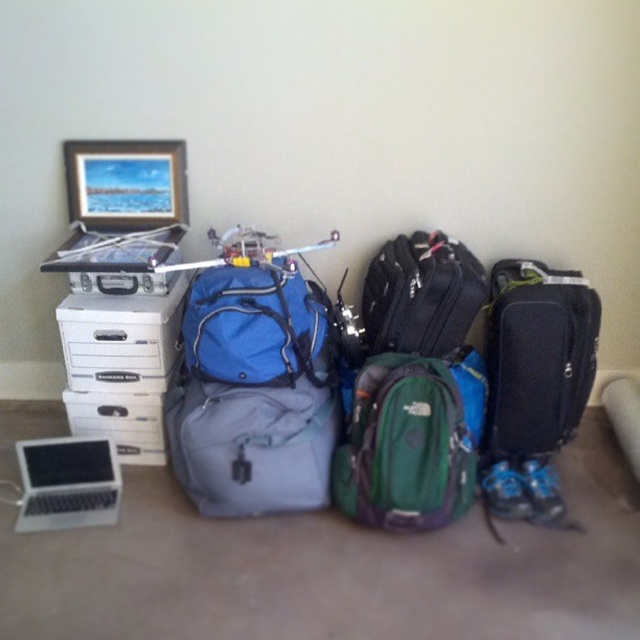
Is white plastic drawer at left behind wooden frame at upper left?

No, it is in front of wooden frame at upper left.

Which is above, white plastic drawer at left or wooden frame at upper left?

wooden frame at upper left is higher up.

Does point (132, 452) come farther from viewer compared to point (156, 188)?

That is True.

At what (x,y) coordinates should I click in order to perform the action: click on white plastic drawer at left. Please return your answer as a coordinate pair (x, y). This screenshot has height=640, width=640. Looking at the image, I should click on (120, 365).

Does green fabric backpack at center have a greater height compared to silver metallic laptop at lower left?

Yes, green fabric backpack at center is taller than silver metallic laptop at lower left.

Can you confirm if green fabric backpack at center is smaller than silver metallic laptop at lower left?

Incorrect, green fabric backpack at center is not smaller in size than silver metallic laptop at lower left.

Where is `green fabric backpack at center`? green fabric backpack at center is located at coordinates (404, 445).

Who is positioned more to the left, black textured suitcase at right or wooden frame at upper left?

wooden frame at upper left

Can you confirm if black textured suitcase at right is positioned below wooden frame at upper left?

Yes.

The height and width of the screenshot is (640, 640). What are the coordinates of `black textured suitcase at right` in the screenshot? It's located at (536, 358).